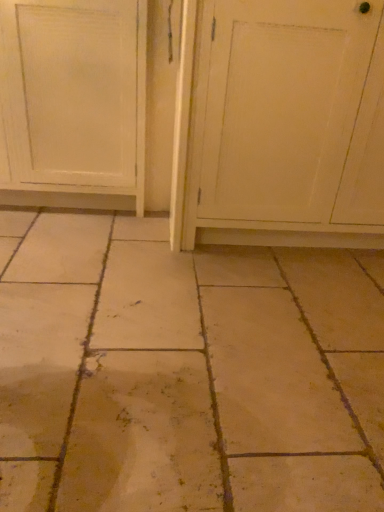
Question: Considering the relative sizes of white painted wood door at left and white wood screen door at center in the image provided, is white painted wood door at left shorter than white wood screen door at center?

Choices:
 (A) no
 (B) yes

Answer: (B)

Question: Is white painted wood door at left next to white wood screen door at center?

Choices:
 (A) yes
 (B) no

Answer: (B)

Question: Can you confirm if white painted wood door at left is bigger than white wood screen door at center?

Choices:
 (A) yes
 (B) no

Answer: (B)

Question: Is white painted wood door at left outside white wood screen door at center?

Choices:
 (A) no
 (B) yes

Answer: (B)

Question: Is the position of white painted wood door at left less distant than that of white wood screen door at center?

Choices:
 (A) no
 (B) yes

Answer: (A)

Question: Is white painted wood door at left oriented away from white wood screen door at center?

Choices:
 (A) no
 (B) yes

Answer: (A)

Question: From the image's perspective, would you say white wood screen door at center is shown under white painted wood door at left?

Choices:
 (A) no
 (B) yes

Answer: (B)

Question: Is white wood screen door at center thinner than white painted wood door at left?

Choices:
 (A) no
 (B) yes

Answer: (B)

Question: Can you confirm if white wood screen door at center is shorter than white painted wood door at left?

Choices:
 (A) yes
 (B) no

Answer: (B)

Question: Is white wood screen door at center positioned beyond the bounds of white painted wood door at left?

Choices:
 (A) no
 (B) yes

Answer: (B)

Question: Does white wood screen door at center contain white painted wood door at left?

Choices:
 (A) no
 (B) yes

Answer: (A)

Question: Is white wood screen door at center at the right side of white painted wood door at left?

Choices:
 (A) yes
 (B) no

Answer: (A)

Question: From the image's perspective, relative to white painted wood door at left, is white wood screen door at center above or below?

Choices:
 (A) above
 (B) below

Answer: (B)